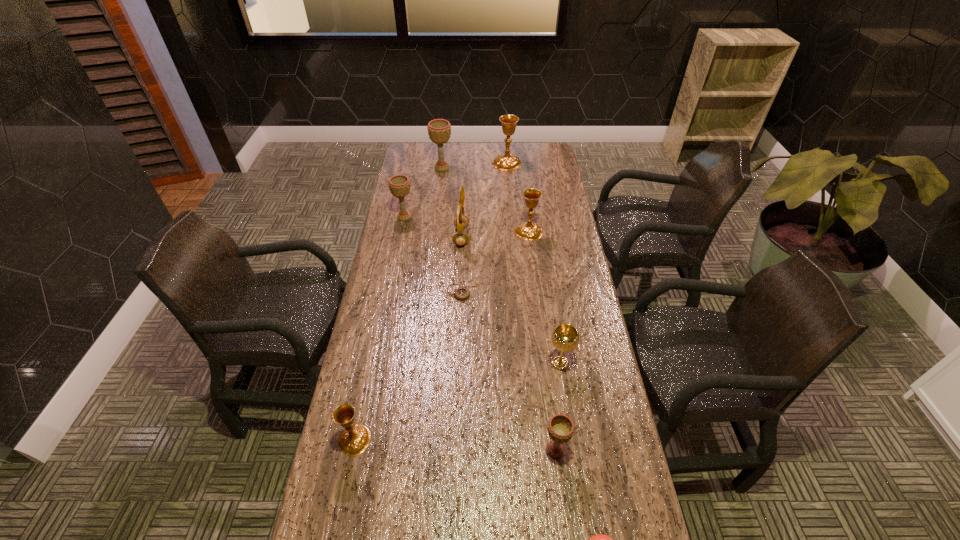
Find the location of `free space between the biggest gold chalice and the sixth farthest object`. free space between the biggest gold chalice and the sixth farthest object is located at coordinates (485, 226).

Locate an element on the screen. This screenshot has width=960, height=540. empty space that is in between the second biggest beige chalice and the seventh farthest object is located at coordinates (482, 290).

Locate an element on the screen. vacant point located between the sixth farthest object and the rightmost beige chalice is located at coordinates (509, 370).

At what (x,y) coordinates should I click in order to perform the action: click on free space between the smallest gold chalice and the smallest beige chalice. Please return your answer as a coordinate pair (x, y). Looking at the image, I should click on (454, 445).

Where is `empty location between the second smallest beige chalice and the smallest beige chalice`? empty location between the second smallest beige chalice and the smallest beige chalice is located at coordinates (480, 334).

What are the coordinates of `free space between the fourth nearest object and the biggest gold chalice` in the screenshot? It's located at (533, 263).

In order to click on empty location between the pocket watch and the second smallest gold chalice in this screenshot , I will do `click(495, 261)`.

Identify which object is located as the sixth nearest to the nearest object. Please provide its 2D coordinates. Your answer should be formatted as a tuple, i.e. [(x, y)], where the tuple contains the x and y coordinates of a point satisfying the conditions above.

[(530, 231)]

Locate an element on the screen. object that can be found as the closest to the nearest gold chalice is located at coordinates (560, 427).

Identify the location of the sixth closest chalice to the brown earphone. This screenshot has width=960, height=540. (354, 439).